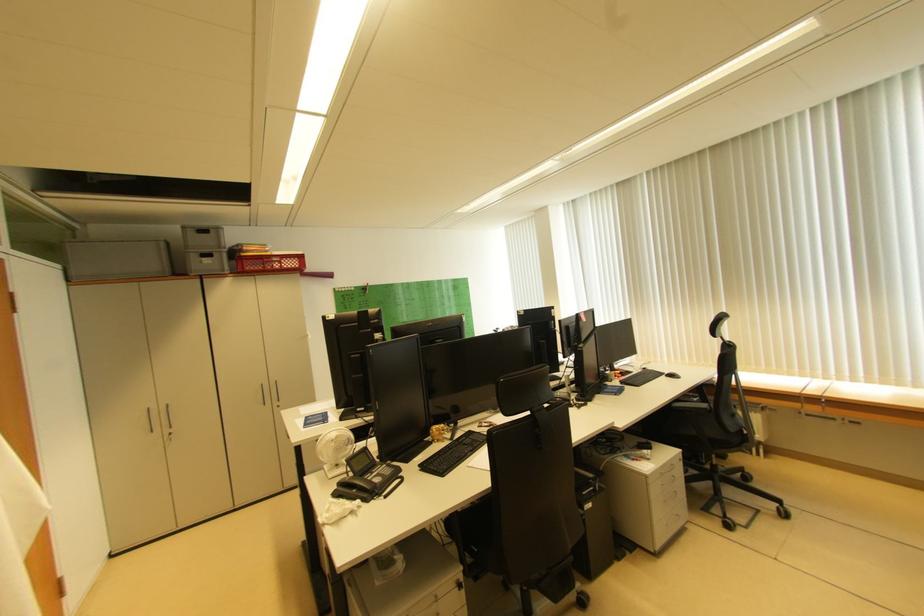
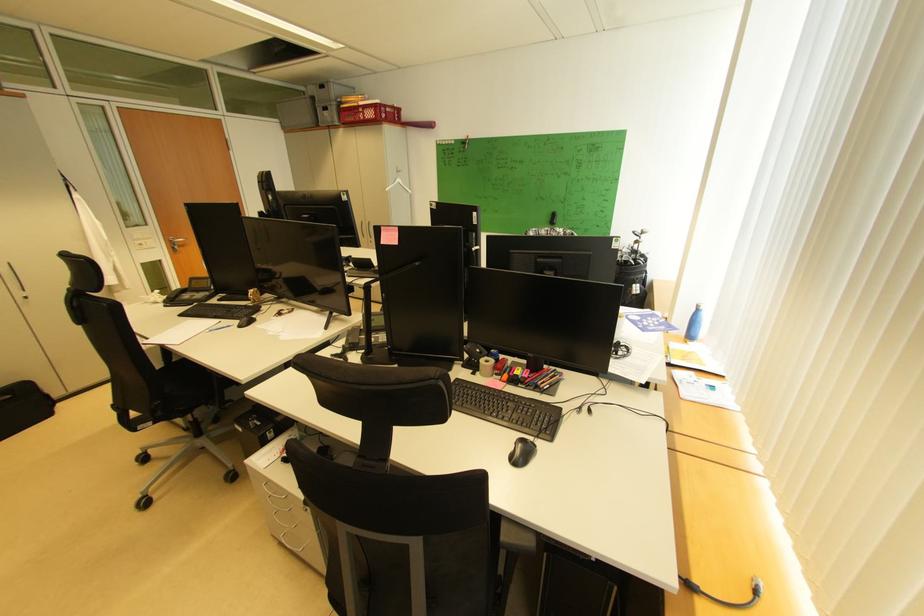
Locate, in the second image, the point that corresponds to the point at 290,267 in the first image.

(372, 118)